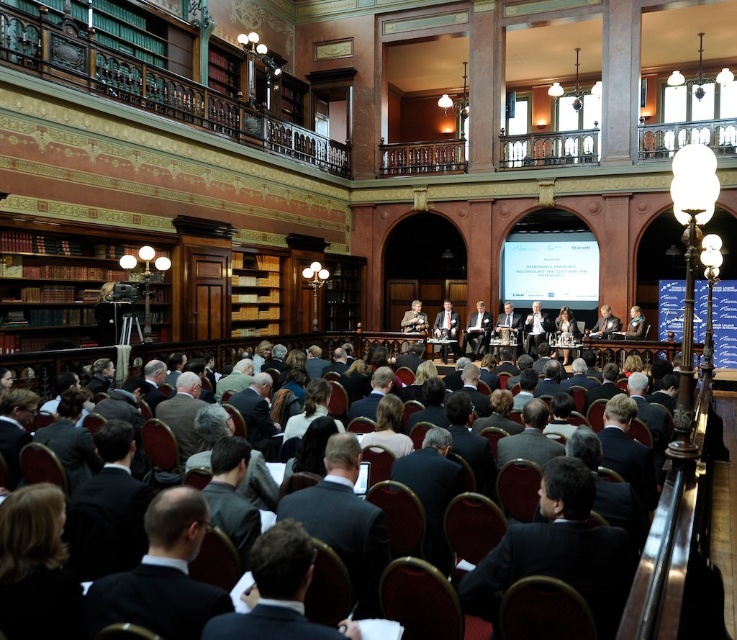
Can you confirm if light brown wood chair at center is thinner than light brown wood podium at center?

Yes, light brown wood chair at center is thinner than light brown wood podium at center.

Find the location of a particular element. The image size is (737, 640). light brown wood chair at center is located at coordinates (475, 332).

Find the location of `light brown wood chair at center`. light brown wood chair at center is located at coordinates (475, 332).

Who is lower down, light brown wood chair at center or light brown leather jacket at center?

light brown leather jacket at center is below.

Between point (486, 340) and point (527, 339), which one is positioned in front?

Positioned in front is point (527, 339).

Between point (478, 333) and point (539, 332), which one is positioned behind?

Positioned behind is point (478, 333).

Locate an element on the screen. This screenshot has height=640, width=737. light brown wood chair at center is located at coordinates (475, 332).

Is light brown wood podium at center above light brown leather jacket at center?

Yes, light brown wood podium at center is above light brown leather jacket at center.

Who is shorter, light brown wood podium at center or light brown leather jacket at center?

With less height is light brown leather jacket at center.

This screenshot has width=737, height=640. What are the coordinates of `light brown wood podium at center` in the screenshot? It's located at (447, 326).